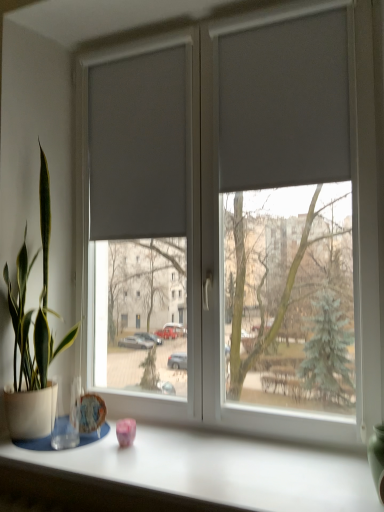
Question: From their relative heights in the image, would you say white matte table at lower center is taller or shorter than matte gray curtain at left, which is counted as the second curtain, starting from the right?

Choices:
 (A) tall
 (B) short

Answer: (B)

Question: From a real-world perspective, relative to matte gray curtain at left, which is counted as the second curtain, starting from the right, is white matte table at lower center vertically above or below?

Choices:
 (A) below
 (B) above

Answer: (A)

Question: Estimate the real-world distances between objects in this image. Which object is farther from the matte gray curtain at upper right, the first curtain viewed from the right?

Choices:
 (A) matte gray curtain at left, which is the 2th curtain from front to back
 (B) green matte glass vase at right
 (C) green glossy plant at left
 (D) matte gray blinds at center
 (E) white matte table at lower center

Answer: (E)

Question: Estimate the real-world distances between objects in this image. Which object is closer to the matte gray blinds at center?

Choices:
 (A) matte gray curtain at left, the 1th curtain when ordered from back to front
 (B) green matte glass vase at right
 (C) white matte table at lower center
 (D) matte gray curtain at upper right, the first curtain viewed from the right
 (E) green glossy plant at left

Answer: (A)